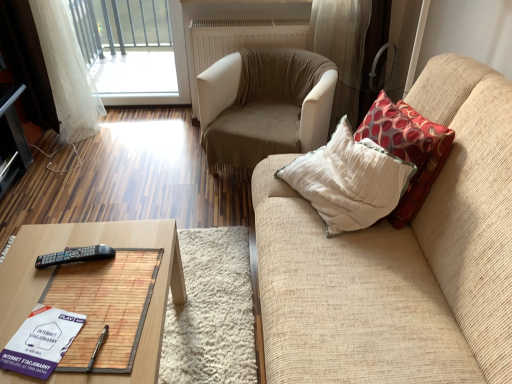
Locate an element on the screen. Image resolution: width=512 pixels, height=384 pixels. vacant area that lies in front of black plastic remote at lower left is located at coordinates point(61,296).